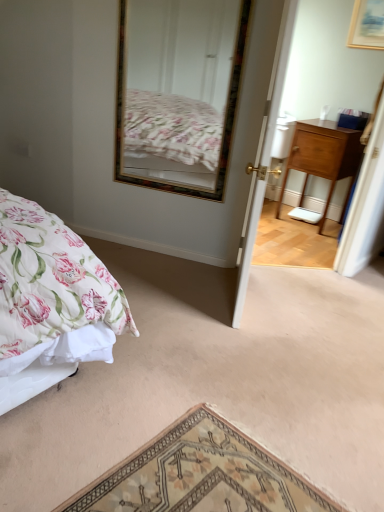
Where is `free space to the left of white wooden door at center`? free space to the left of white wooden door at center is located at coordinates (170, 286).